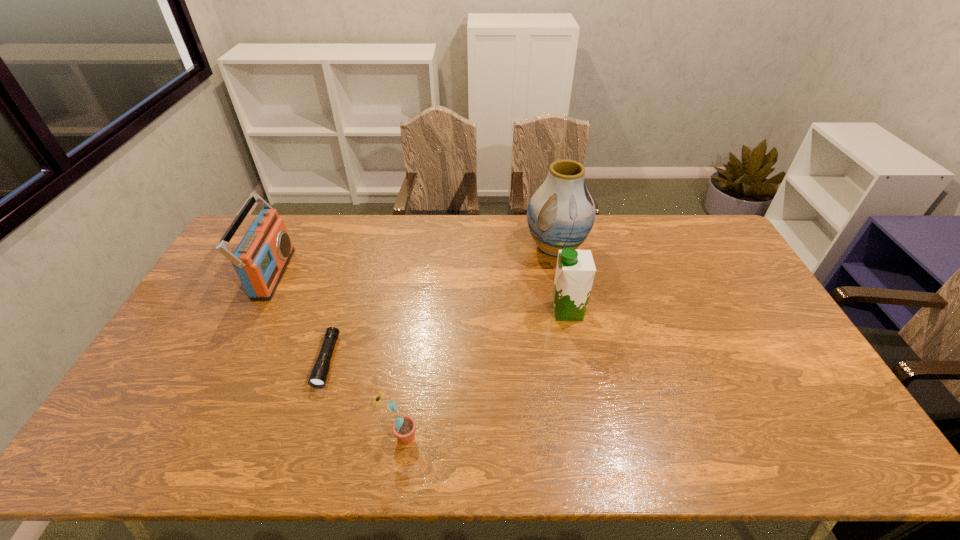
Identify the location of object that ranks as the closest to the tallest object. This screenshot has width=960, height=540. (575, 271).

At what (x,y) coordinates should I click in order to perform the action: click on free location that satisfies the following two spatial constraints: 1. on the front-facing side of the soya milk; 2. at the lens end of the shortest object. Please return your answer as a coordinate pair (x, y). Looking at the image, I should click on (577, 361).